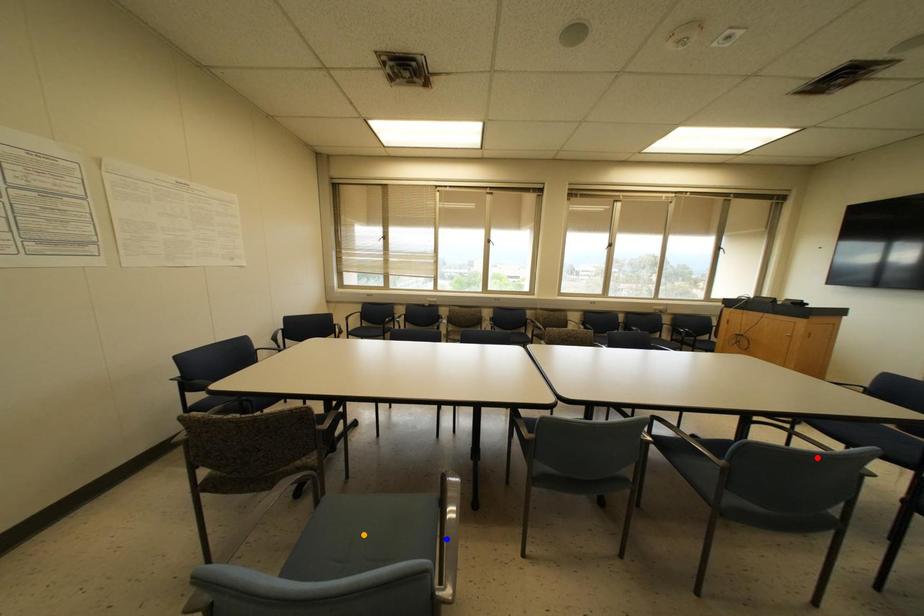
Order these from nearest to farthest:
orange point
red point
blue point

orange point
red point
blue point